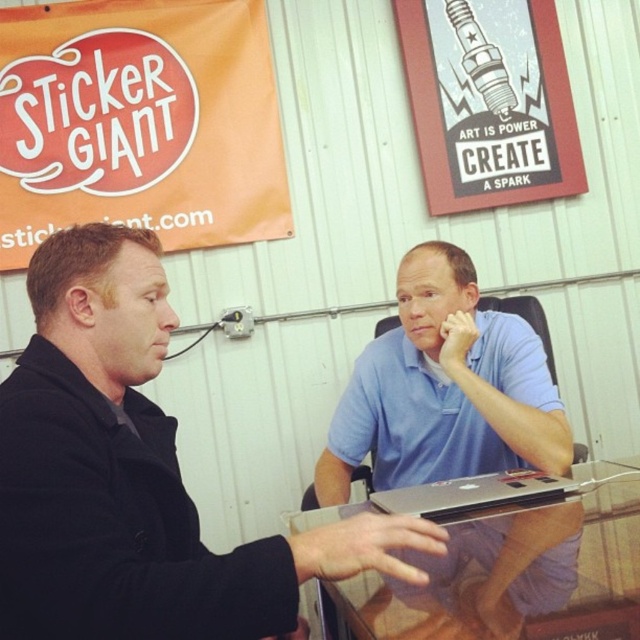
Does black matte jacket at center have a lesser width compared to transparent glass table at center?

Yes, black matte jacket at center is thinner than transparent glass table at center.

Can you confirm if black matte jacket at center is wider than transparent glass table at center?

No.

The image size is (640, 640). What do you see at coordinates (134, 476) in the screenshot?
I see `black matte jacket at center` at bounding box center [134, 476].

Locate an element on the screen. black matte jacket at center is located at coordinates 134,476.

Looking at this image, is blue cotton shirt at center above silver metallic laptop at center?

Yes.

From the picture: Does blue cotton shirt at center have a greater height compared to silver metallic laptop at center?

Correct, blue cotton shirt at center is much taller as silver metallic laptop at center.

This screenshot has height=640, width=640. What are the coordinates of `blue cotton shirt at center` in the screenshot? It's located at (444, 388).

From the picture: Is the position of black matte jacket at center more distant than that of silver metallic laptop at center?

That is False.

Locate an element on the screen. The width and height of the screenshot is (640, 640). black matte jacket at center is located at coordinates point(134,476).

Where is `black matte jacket at center`? The image size is (640, 640). black matte jacket at center is located at coordinates (134, 476).